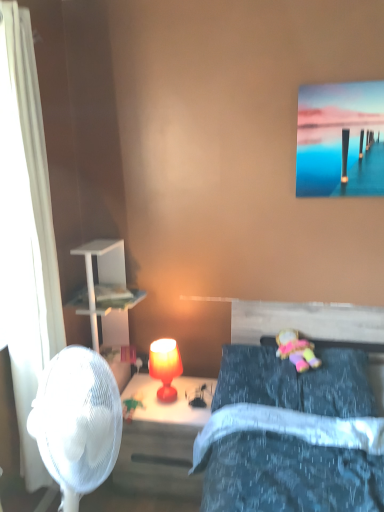
Question: Is plush fabric doll at center at the right side of white sheer curtain at left?

Choices:
 (A) yes
 (B) no

Answer: (A)

Question: Is plush fabric doll at center thinner than white sheer curtain at left?

Choices:
 (A) no
 (B) yes

Answer: (A)

Question: Is the depth of plush fabric doll at center greater than that of white sheer curtain at left?

Choices:
 (A) yes
 (B) no

Answer: (A)

Question: Is plush fabric doll at center in front of white sheer curtain at left?

Choices:
 (A) no
 (B) yes

Answer: (A)

Question: From a real-world perspective, does plush fabric doll at center stand above white sheer curtain at left?

Choices:
 (A) yes
 (B) no

Answer: (B)

Question: Is point (26, 173) closer or farther from the camera than point (283, 342)?

Choices:
 (A) closer
 (B) farther

Answer: (A)

Question: From the image's perspective, is white sheer curtain at left positioned above or below plush fabric doll at center?

Choices:
 (A) above
 (B) below

Answer: (A)

Question: Based on their sizes in the image, would you say white sheer curtain at left is bigger or smaller than plush fabric doll at center?

Choices:
 (A) big
 (B) small

Answer: (A)

Question: From a real-world perspective, is white sheer curtain at left positioned above or below plush fabric doll at center?

Choices:
 (A) below
 (B) above

Answer: (B)

Question: Considering the positions of matte orange lamp at center and matte red lamp at center in the image, is matte orange lamp at center bigger or smaller than matte red lamp at center?

Choices:
 (A) big
 (B) small

Answer: (B)

Question: Considering the positions of matte orange lamp at center and matte red lamp at center in the image, is matte orange lamp at center taller or shorter than matte red lamp at center?

Choices:
 (A) tall
 (B) short

Answer: (B)

Question: From the image's perspective, relative to matte red lamp at center, is matte orange lamp at center above or below?

Choices:
 (A) above
 (B) below

Answer: (A)

Question: In terms of width, does matte orange lamp at center look wider or thinner when compared to matte red lamp at center?

Choices:
 (A) wide
 (B) thin

Answer: (B)

Question: Is matte red lamp at center spatially inside velvet blue pillow at lower right, or outside of it?

Choices:
 (A) outside
 (B) inside

Answer: (A)

Question: Would you say matte red lamp at center is to the left or to the right of velvet blue pillow at lower right in the picture?

Choices:
 (A) right
 (B) left

Answer: (B)